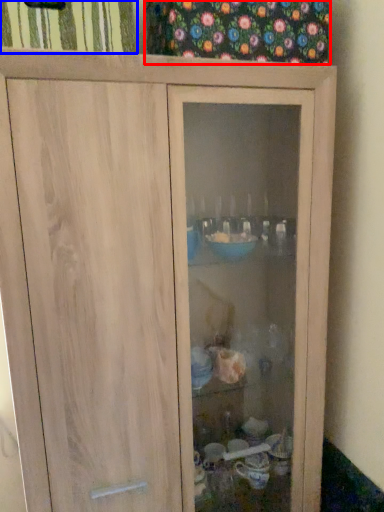
Question: Which object is further to the camera taking this photo, curtain (highlighted by a red box) or curtain (highlighted by a blue box)?

Choices:
 (A) curtain
 (B) curtain

Answer: (A)